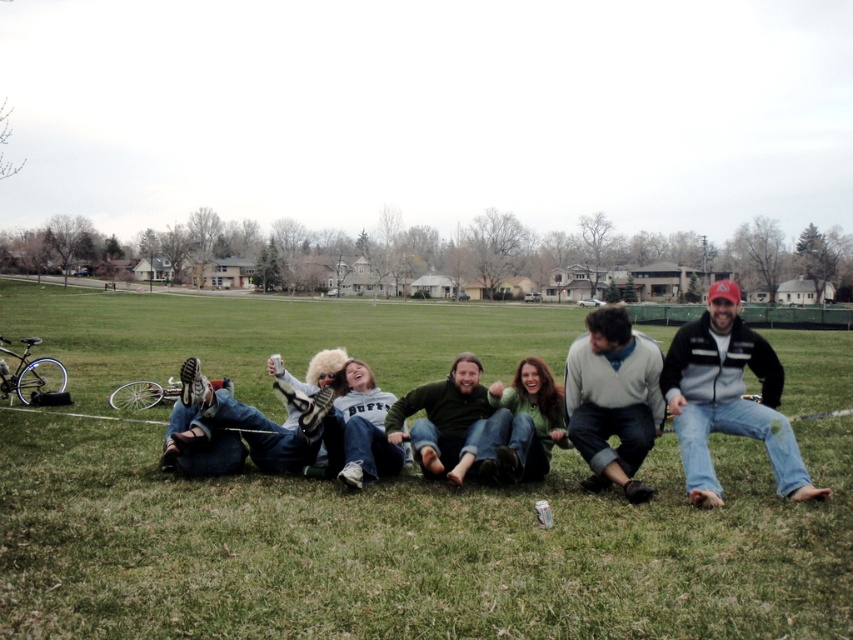
Question: Where is green sweater at center located in relation to green fuzzy sweater at center in the image?

Choices:
 (A) below
 (B) above

Answer: (A)

Question: Which of the following is the farthest from the observer?

Choices:
 (A) white cotton sweatshirt at center
 (B) green fuzzy sweater at center

Answer: (B)

Question: Does green grass at center lie in front of white cotton sweatshirt at center?

Choices:
 (A) yes
 (B) no

Answer: (A)

Question: Is light gray sweater at center further to camera compared to white cotton sweatshirt at center?

Choices:
 (A) yes
 (B) no

Answer: (B)

Question: Which point is closer to the camera?

Choices:
 (A) green grass at center
 (B) light gray sweater at center
 (C) white fuzzy hat at center
 (D) green fuzzy sweater at center

Answer: (A)

Question: Which point is farther to the camera?

Choices:
 (A) (607, 372)
 (B) (259, 442)
 (C) (51, 620)
 (D) (676, 400)

Answer: (B)